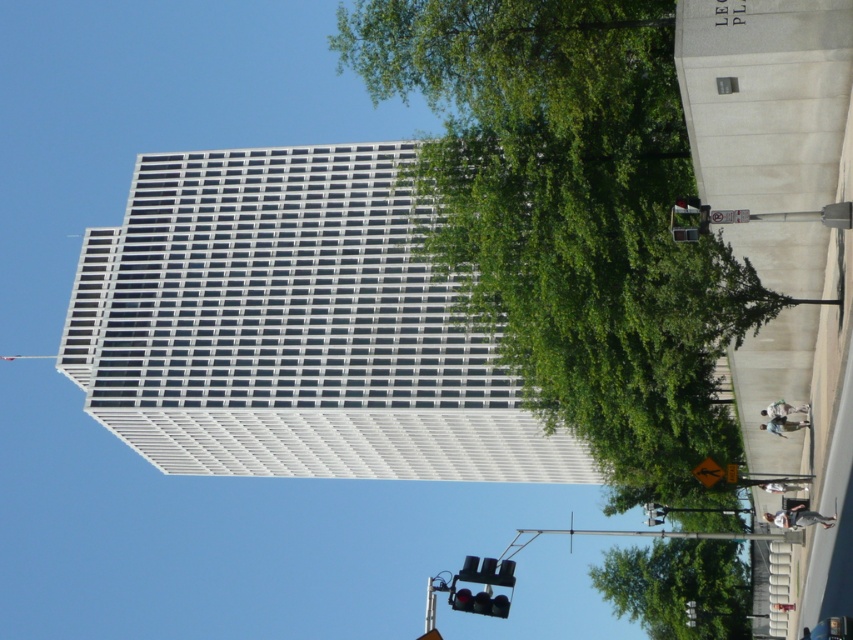
You are a city planner analyzing the image. You need to determine which object occupies more horizontal space in the scene. Which one is wider between the green leafy tree at upper center and the black glass traffic light at lower center?

The green leafy tree at upper center is wider than the black glass traffic light at lower center according to the description.

You are a city planner evaluating the visibility of the black glass traffic light at lower center. Considering the presence of the green leafy tree at lower center, would the traffic light be easily visible to pedestrians?

The green leafy tree at lower center is larger than the black glass traffic light at lower center, which may obstruct the view of the traffic light for pedestrians, making it less visible.

You are a drone operator trying to navigate between two green leafy trees in the scene. The trees are labeled as the green leafy tree at upper center and the green leafy tree at lower center. Which direction should you fly to move from the upper tree to the lower one?

The green leafy tree at upper center is above the green leafy tree at lower center, so you should fly downward to move from the upper tree to the lower one.